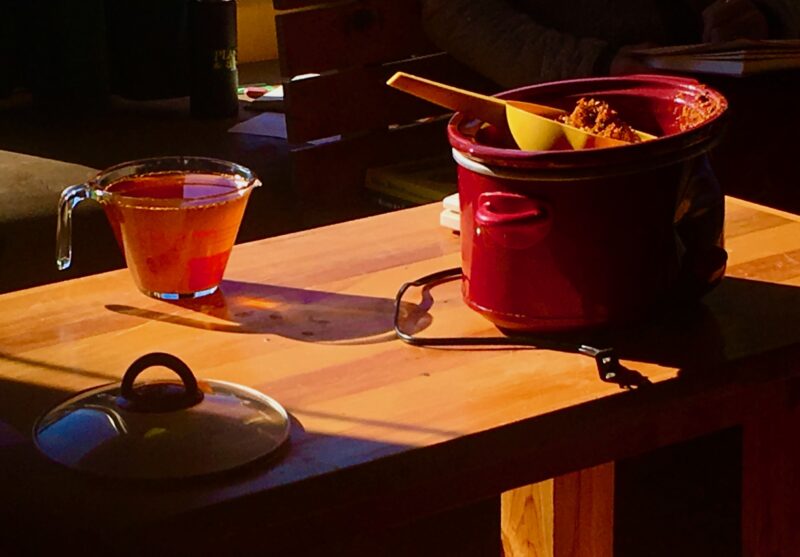
Image resolution: width=800 pixels, height=557 pixels. I want to click on chair back, so pyautogui.click(x=334, y=104), pyautogui.click(x=329, y=48).